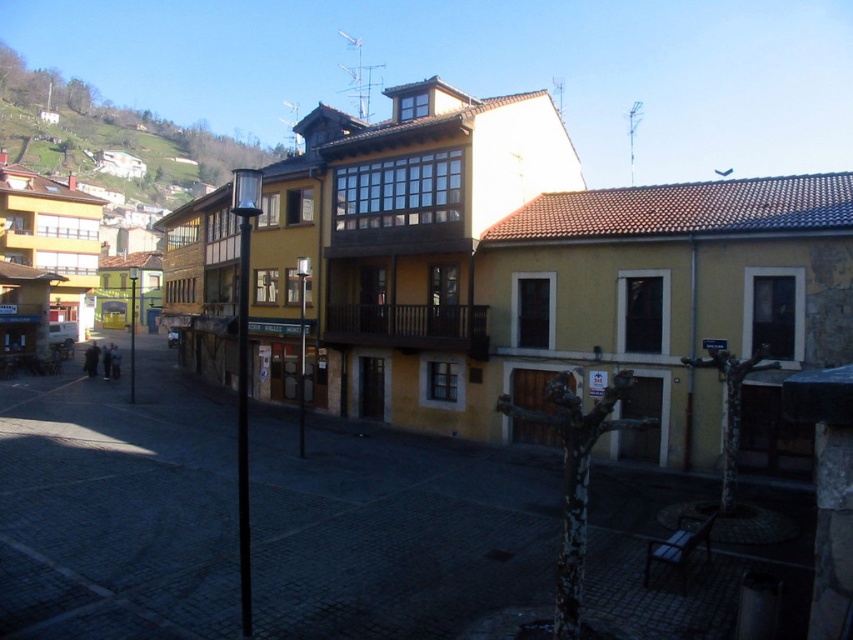
Can you confirm if yellow matte building at center is taller than green grassy hillside at upper left?

Incorrect, yellow matte building at center's height is not larger of green grassy hillside at upper left's.

Does yellow matte building at center appear under green grassy hillside at upper left?

Indeed, yellow matte building at center is positioned under green grassy hillside at upper left.

Which is in front, point (33, 502) or point (167, 157)?

Point (33, 502) is more forward.

The image size is (853, 640). What are the coordinates of `yellow matte building at center` in the screenshot? It's located at (117, 506).